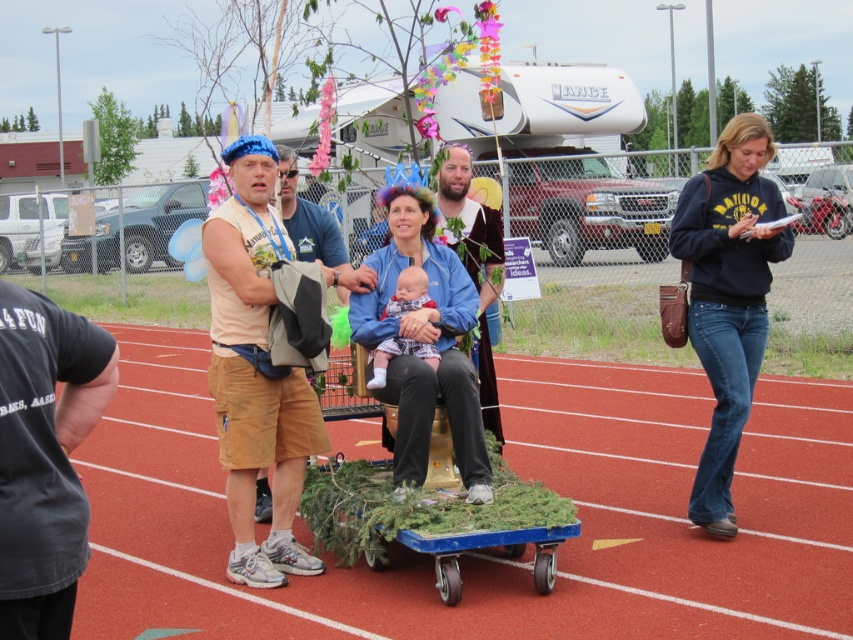
You are a participant in the event and need to retrieve your jacket from the throne. Which jacket should you look under first, the blue denim jacket at center or the brown leather jacket at center?

The blue denim jacket at center is located below the brown leather jacket at center, so you should look under the blue denim jacket at center first.

Based on the photo, you are a participant in the community event and need to locate the blue denim jacket at center. Based on the spatial description provided, where exactly is the blue denim jacket positioned in the image?

The blue denim jacket at center is located at point (427, 342) in the image coordinates.